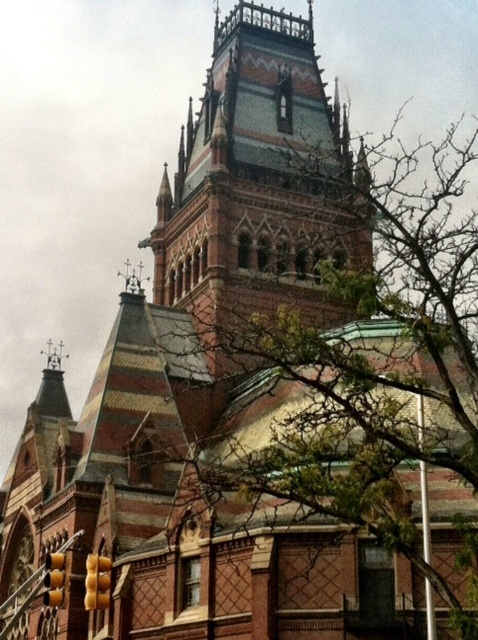
Where is `green leafy tree at upper center`? This screenshot has width=478, height=640. green leafy tree at upper center is located at coordinates (364, 364).

Who is lower down, green leafy tree at upper center or yellow matte traffic light at lower left?

Positioned lower is yellow matte traffic light at lower left.

Which is in front, point (406, 362) or point (96, 554)?

Positioned in front is point (406, 362).

You are a GUI agent. You are given a task and a screenshot of the screen. Output one action in this format:
    pyautogui.click(x=<x>, y=<y>)
    Task: Click on the green leafy tree at upper center
    
    Given the screenshot: What is the action you would take?
    pyautogui.click(x=364, y=364)

Looking at this image, can you confirm if green leafy tree at upper center is positioned to the right of yellow plastic traffic light at lower left?

Yes, green leafy tree at upper center is to the right of yellow plastic traffic light at lower left.

Does point (286, 429) lie in front of point (63, 600)?

No, (286, 429) is further to viewer.

Identify the location of green leafy tree at upper center. This screenshot has width=478, height=640. (364, 364).

Is point (228, 49) less distant than point (47, 557)?

No, (228, 49) is behind (47, 557).

This screenshot has width=478, height=640. What are the coordinates of `reddish-brown brick tower at center` in the screenshot? It's located at (259, 182).

Where is `reddish-brown brick tower at center`? The width and height of the screenshot is (478, 640). reddish-brown brick tower at center is located at coordinates pyautogui.click(x=259, y=182).

The height and width of the screenshot is (640, 478). Identify the location of reddish-brown brick tower at center. (259, 182).